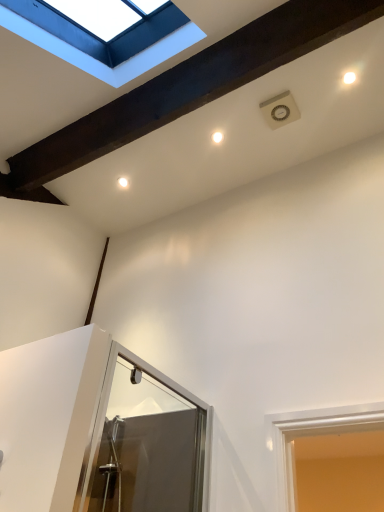
I want to click on white glossy droplight at upper center, so (217, 137).

Describe the element at coordinates (217, 137) in the screenshot. I see `white glossy droplight at upper center` at that location.

What is the approximate height of white painted wood window at upper left?

The height of white painted wood window at upper left is 25.63 inches.

Find the location of `white painted wood window at upper left`. white painted wood window at upper left is located at coordinates (98, 60).

What do you see at coordinates (98, 60) in the screenshot?
I see `white painted wood window at upper left` at bounding box center [98, 60].

Measure the distance between white painted wood window at upper left and camera.

The distance of white painted wood window at upper left from camera is 1.60 meters.

You are a GUI agent. You are given a task and a screenshot of the screen. Output one action in this format:
    pyautogui.click(x=<x>, y=<y>)
    Task: Click on the white glossy droplight at upper center
    
    Given the screenshot: What is the action you would take?
    pyautogui.click(x=217, y=137)

Considering the relative positions of white painted wood window at upper left and white glossy droplight at upper center in the image provided, is white painted wood window at upper left to the left or to the right of white glossy droplight at upper center?

Clearly, white painted wood window at upper left is on the left of white glossy droplight at upper center in the image.

Is white painted wood window at upper left further to the viewer compared to white glossy droplight at upper center?

No, white painted wood window at upper left is in front of white glossy droplight at upper center.

Does point (84, 66) come in front of point (217, 133)?

Yes, it is.

From the image's perspective, who appears lower, white painted wood window at upper left or white glossy droplight at upper center?

From the image's view, white glossy droplight at upper center is below.

From a real-world perspective, between white painted wood window at upper left and white glossy droplight at upper center, who is vertically higher?

From a 3D spatial view, white glossy droplight at upper center is above.

Can you confirm if white painted wood window at upper left is wider than white glossy droplight at upper center?

Indeed, white painted wood window at upper left has a greater width compared to white glossy droplight at upper center.

Is white painted wood window at upper left shorter than white glossy droplight at upper center?

Incorrect, the height of white painted wood window at upper left does not fall short of that of white glossy droplight at upper center.

Considering the relative sizes of white painted wood window at upper left and white glossy droplight at upper center in the image provided, is white painted wood window at upper left bigger than white glossy droplight at upper center?

Correct, white painted wood window at upper left is larger in size than white glossy droplight at upper center.

Could white glossy droplight at upper center be considered to be inside white painted wood window at upper left?

No, white glossy droplight at upper center is not surrounded by white painted wood window at upper left.

Is white painted wood window at upper left not near white glossy droplight at upper center?

That's not correct — white painted wood window at upper left is a little close to white glossy droplight at upper center.

Could you tell me if white painted wood window at upper left is facing white glossy droplight at upper center?

Yes, white painted wood window at upper left is facing white glossy droplight at upper center.

Can you tell me how much white painted wood window at upper left and white glossy droplight at upper center differ in facing direction?

177 degrees separate the facing orientations of white painted wood window at upper left and white glossy droplight at upper center.

How much distance is there between white painted wood window at upper left and white glossy droplight at upper center?

The distance of white painted wood window at upper left from white glossy droplight at upper center is 29.42 inches.

This screenshot has width=384, height=512. In order to click on window located underneath the white glossy droplight at upper center (from a real-world perspective) in this screenshot , I will do `click(98, 60)`.

Is white glossy droplight at upper center to the left of white painted wood window at upper left from the viewer's perspective?

No, white glossy droplight at upper center is not to the left of white painted wood window at upper left.

Does white glossy droplight at upper center lie in front of white painted wood window at upper left?

No, white glossy droplight at upper center is further to the viewer.

Is point (217, 138) positioned after point (79, 50)?

Yes.

From the image's perspective, is white glossy droplight at upper center located above or below white painted wood window at upper left?

Based on their image positions, white glossy droplight at upper center is located beneath white painted wood window at upper left.

From a real-world perspective, between white glossy droplight at upper center and white painted wood window at upper left, who is vertically higher?

white glossy droplight at upper center.

Between white glossy droplight at upper center and white painted wood window at upper left, which one has smaller width?

white glossy droplight at upper center is thinner.

Considering the relative sizes of white glossy droplight at upper center and white painted wood window at upper left in the image provided, is white glossy droplight at upper center taller than white painted wood window at upper left?

Incorrect, the height of white glossy droplight at upper center is not larger of that of white painted wood window at upper left.

Can you confirm if white glossy droplight at upper center is bigger than white painted wood window at upper left?

Incorrect, white glossy droplight at upper center is not larger than white painted wood window at upper left.

Would you say white painted wood window at upper left is part of white glossy droplight at upper center's contents?

Definitely not — white painted wood window at upper left is not inside white glossy droplight at upper center.

Can you see white glossy droplight at upper center touching white painted wood window at upper left?

No, white glossy droplight at upper center is not touching white painted wood window at upper left.

Is white glossy droplight at upper center facing away from white painted wood window at upper left?

white glossy droplight at upper center is not turned away from white painted wood window at upper left.

Find the location of `window above the white glossy droplight at upper center (from the image's perspective)`. window above the white glossy droplight at upper center (from the image's perspective) is located at coordinates (98, 60).

You are a GUI agent. You are given a task and a screenshot of the screen. Output one action in this format:
    pyautogui.click(x=<x>, y=<y>)
    Task: Click on the window below the white glossy droplight at upper center (from a real-world perspective)
    This screenshot has height=512, width=384.
    Given the screenshot: What is the action you would take?
    pyautogui.click(x=98, y=60)

In the image, there is a white painted wood window at upper left. What are the coordinates of `droplight below it (from the image's perspective)` in the screenshot? It's located at point(217,137).